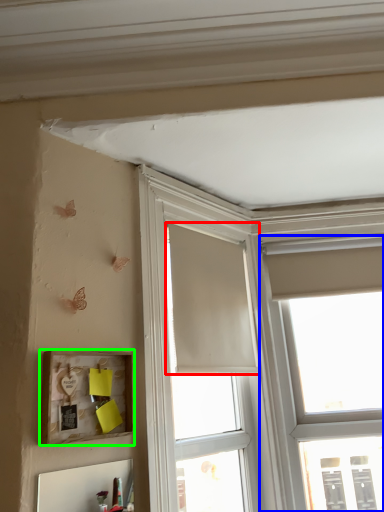
Question: Based on their relative distances, which object is nearer to curtain (highlighted by a red box)? Choose from window (highlighted by a blue box) and picture frame (highlighted by a green box).

Choices:
 (A) window
 (B) picture frame

Answer: (A)